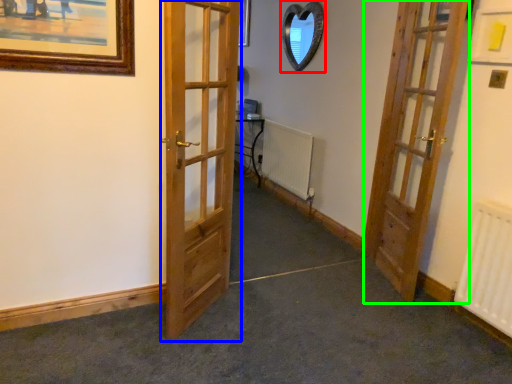
Question: Which is farther away from mirror (highlighted by a red box)? door (highlighted by a blue box) or door (highlighted by a green box)?

Choices:
 (A) door
 (B) door

Answer: (A)